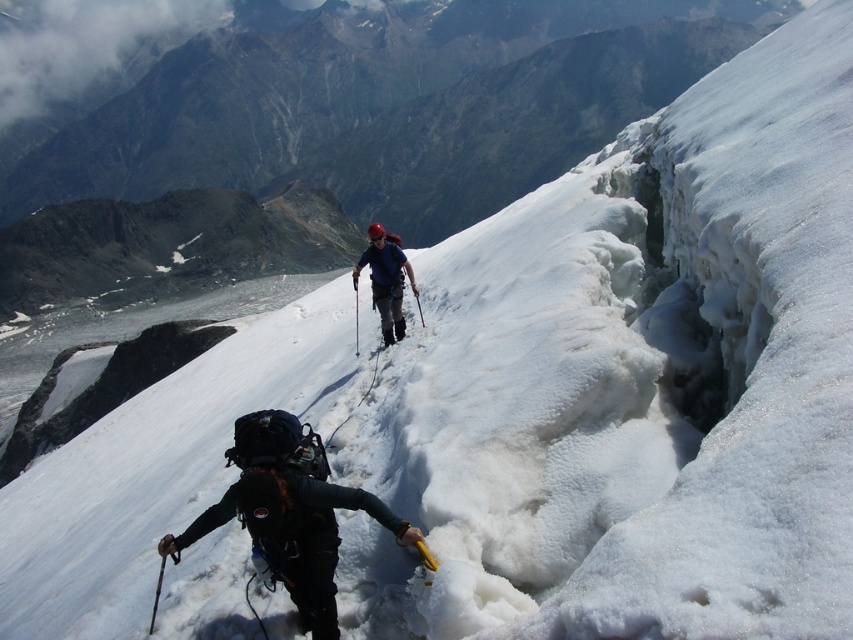
Does black nylon backpack at center appear under matte blue jacket at center?

Indeed, black nylon backpack at center is positioned under matte blue jacket at center.

Where is `black nylon backpack at center`? Image resolution: width=853 pixels, height=640 pixels. black nylon backpack at center is located at coordinates (288, 513).